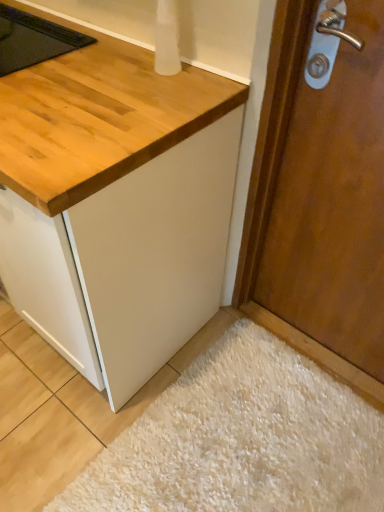
Locate an element on the screen. This screenshot has height=512, width=384. free point above white shaggy rug at lower right (from a real-world perspective) is located at coordinates [x=246, y=443].